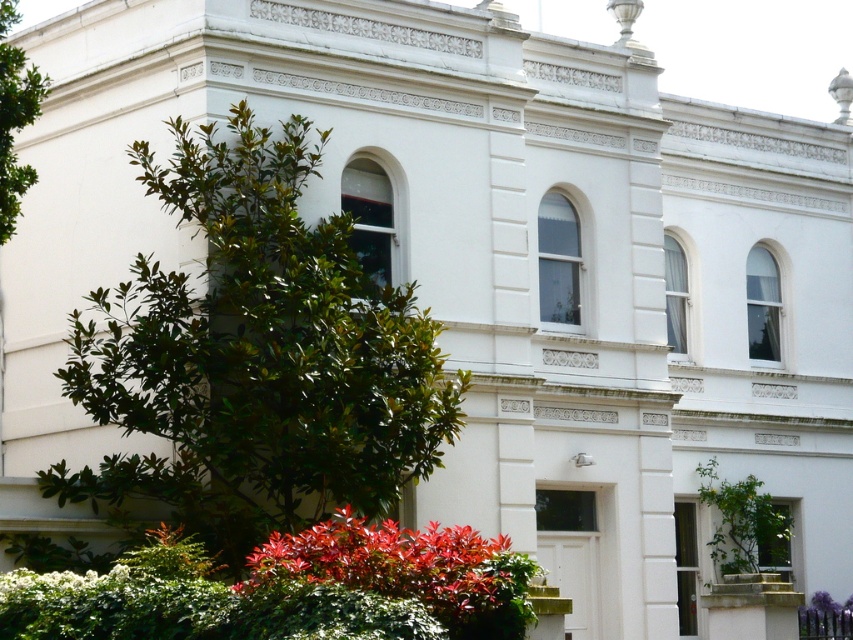
From the picture: You are a gardener who needs to trim the shiny red leaves at lower center and the green leafy tree at left. Which one requires a ladder to reach the top?

The shiny red leaves at lower center requires a ladder to reach the top because it is taller than the green leafy tree at left.

You are a gardener planning to plant a new tree in the yard. You notice the green leafy tree at center and the shiny red leaves at lower center. Which area has more space available for planting a new tree?

The area near the shiny red leaves at lower center has more space available because the green leafy tree at center is wider, leaving less room in its vicinity.